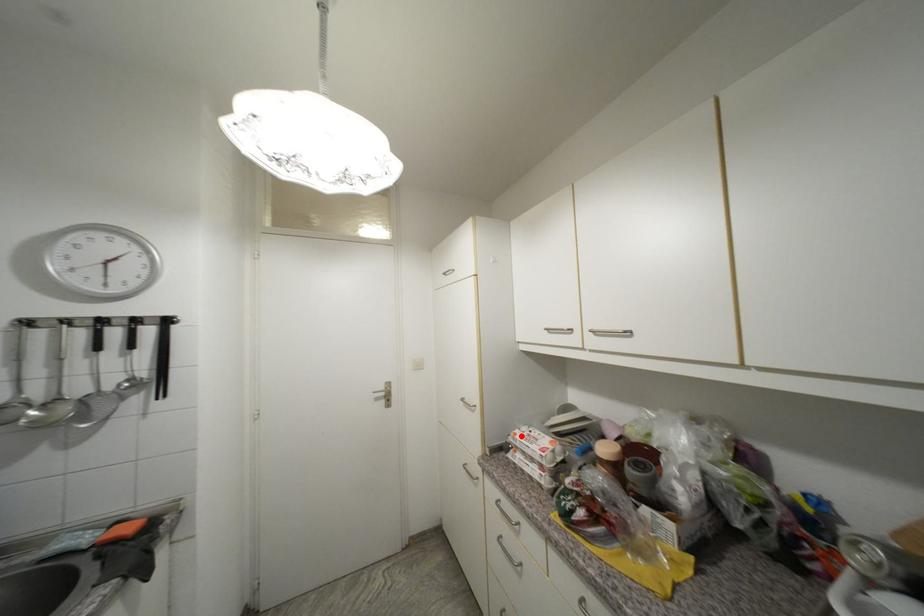
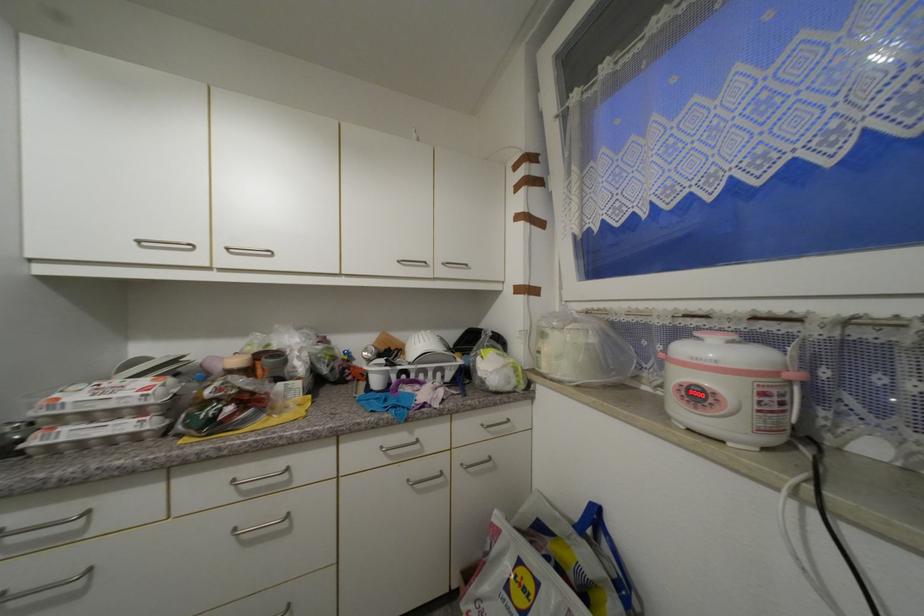
Find the pixel in the second image that matches the highlighted location in the first image.

(64, 400)